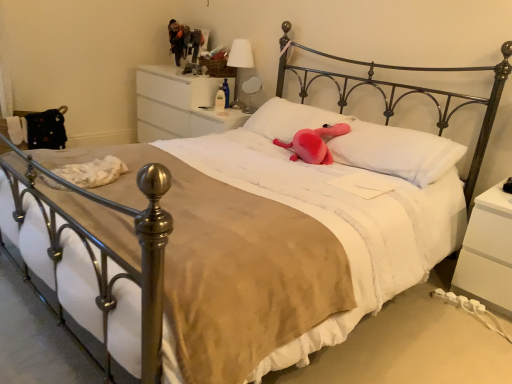
In order to click on vacant space underneath white fabric-covered table lamp at upper center, the 2th table lamp when ordered from bottom to top (from a real-world perspective) in this screenshot , I will do `click(237, 109)`.